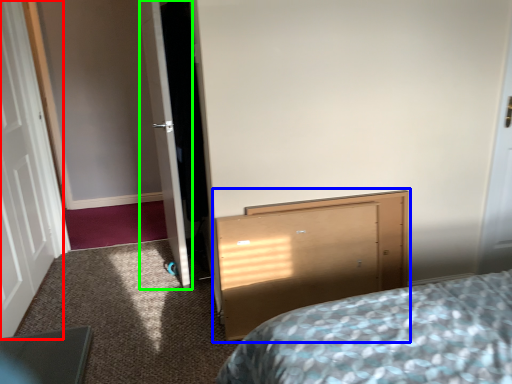
Question: Which object is the closest to the door (highlighted by a red box)? Choose among these: vanity (highlighted by a blue box) or door (highlighted by a green box).

Choices:
 (A) vanity
 (B) door

Answer: (B)